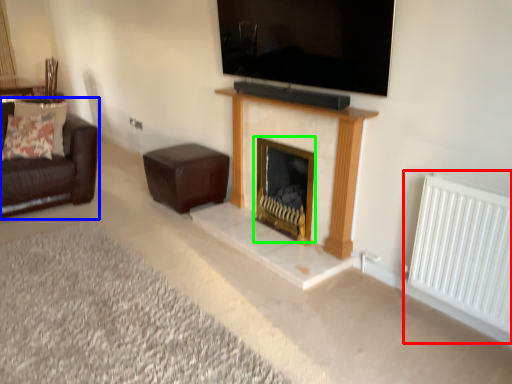
Question: Considering the real-world distances, which object is closest to radiator (highlighted by a red box)? studio couch (highlighted by a blue box) or fireplace (highlighted by a green box).

Choices:
 (A) studio couch
 (B) fireplace

Answer: (B)